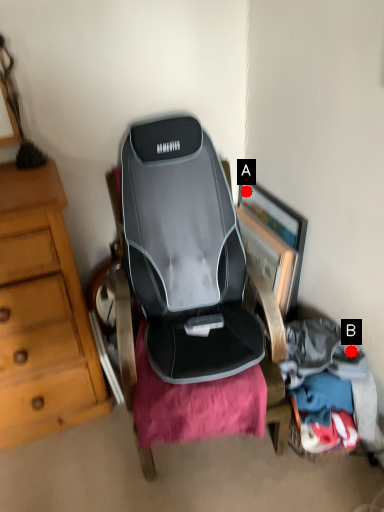
Question: Two points are circled on the image, labeled by A and B beside each circle. Which point appears farthest from the camera in this image?

Choices:
 (A) A is further
 (B) B is further

Answer: (A)